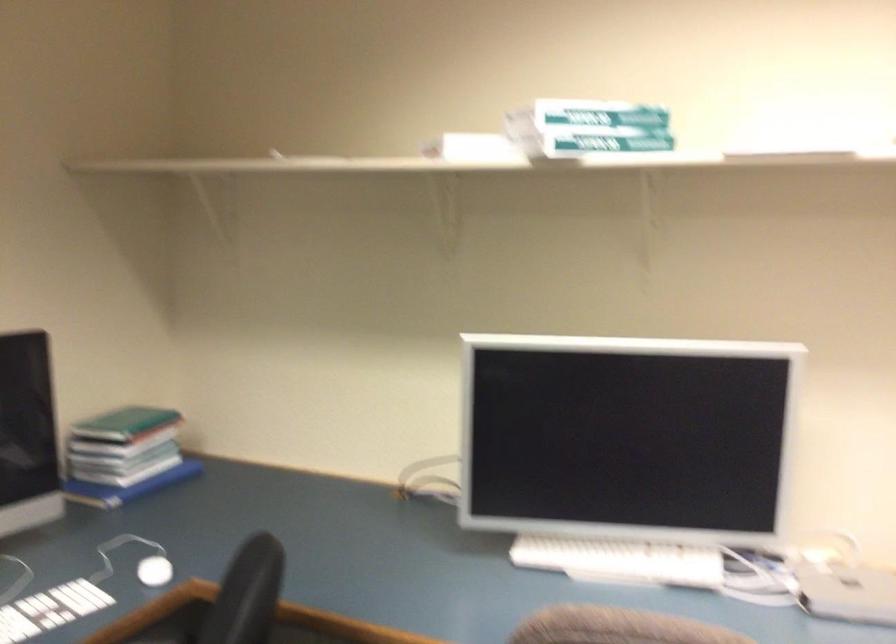
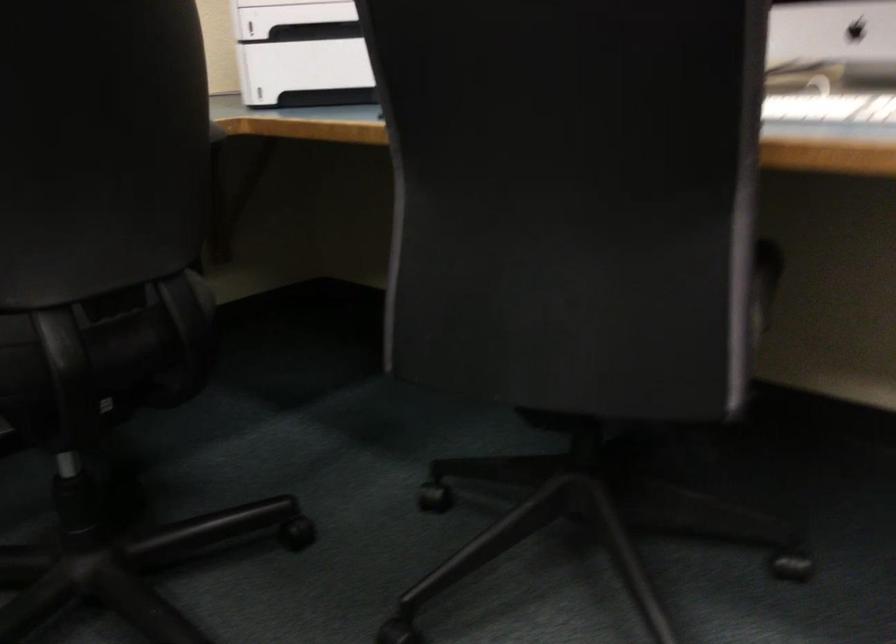
The first image is from the beginning of the video and the second image is from the end. How did the camera likely rotate when shooting the video?

The camera rotated toward left-down.